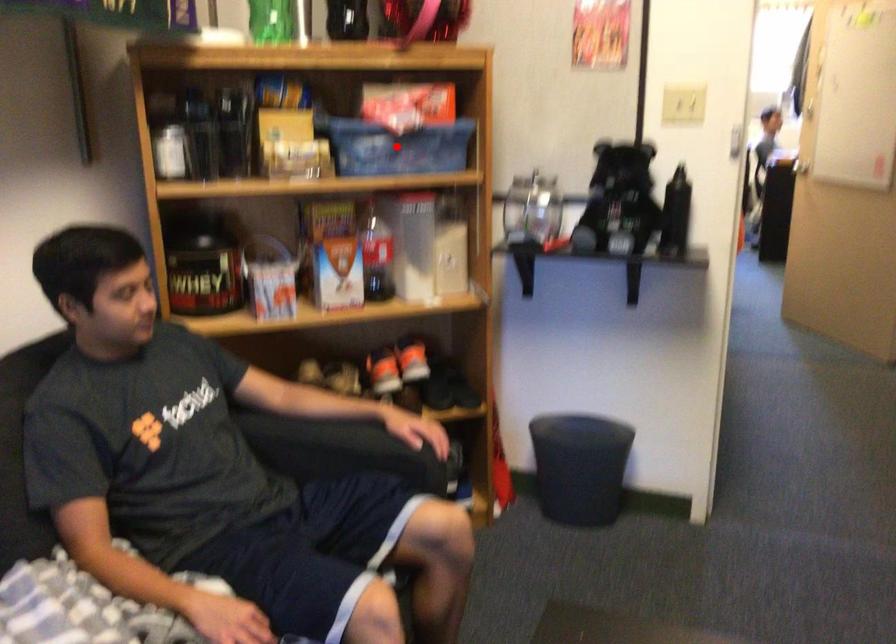
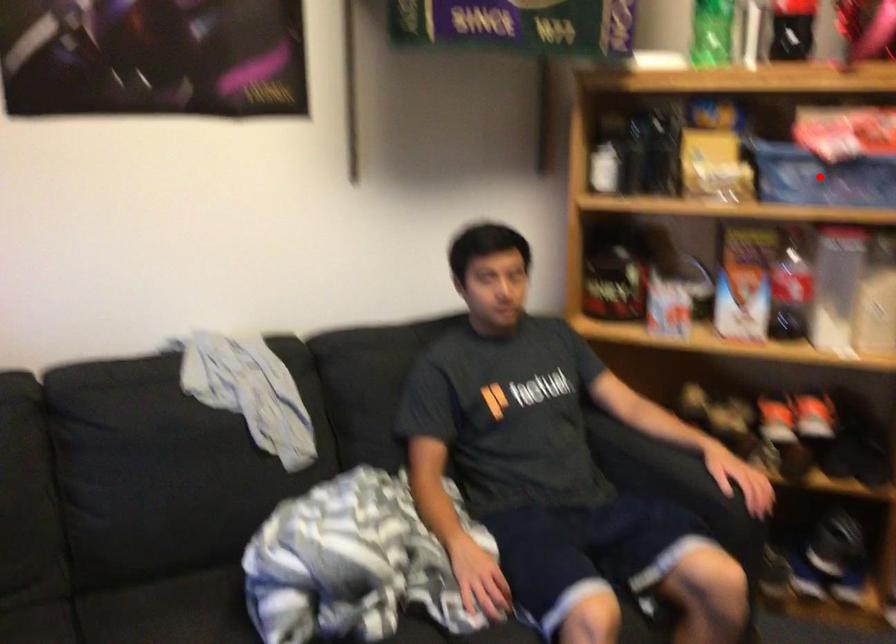
I am providing you with two images of the same scene from different viewpoints. A red point is marked on the first image and another point is marked on the second image. Does the point marked in image1 correspond to the same location as the one in image2?

Yes